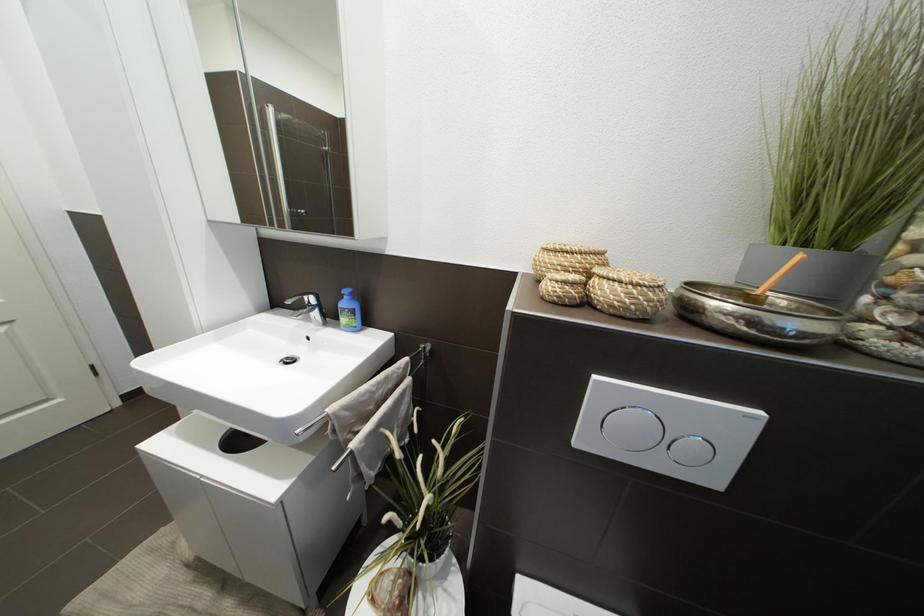
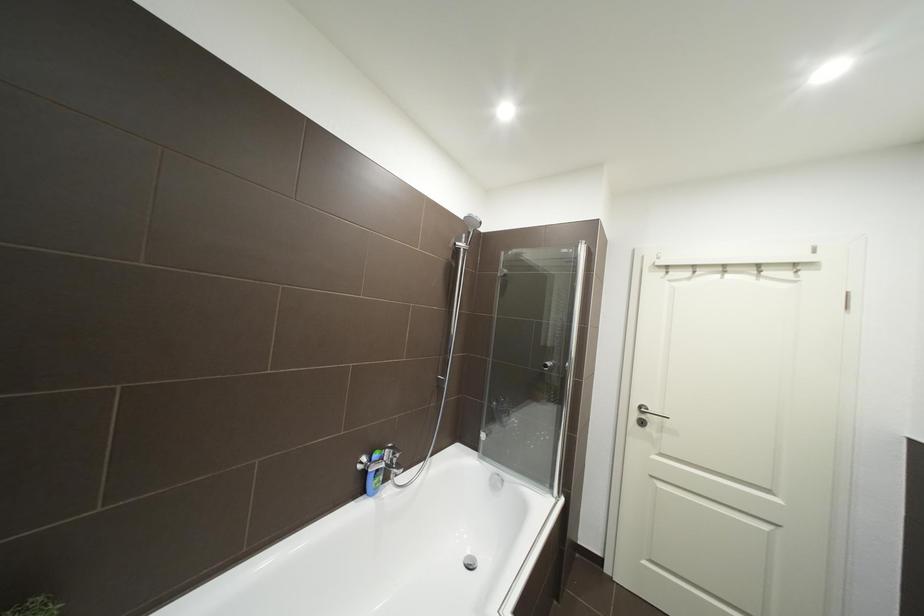
Question: Based on the continuous images, in which direction is the camera rotating? Reply with the corresponding letter.

Choices:
 (A) Left
 (B) Right
 (C) Up
 (D) Down

Answer: (A)